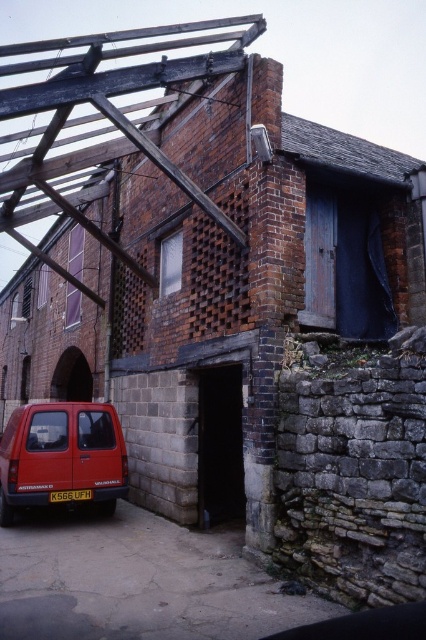
Question: Does black stone door at lower center appear under yellow plastic license plate at lower center?

Choices:
 (A) yes
 (B) no

Answer: (B)

Question: Considering the real-world distances, which object is farthest from the matte red van at lower left?

Choices:
 (A) black stone door at lower center
 (B) yellow plastic license plate at lower center

Answer: (A)

Question: Is matte red van at lower left above yellow plastic license plate at lower center?

Choices:
 (A) no
 (B) yes

Answer: (B)

Question: Does matte red van at lower left have a smaller size compared to yellow plastic license plate at lower center?

Choices:
 (A) no
 (B) yes

Answer: (A)

Question: Which of these objects is positioned closest to the black stone door at lower center?

Choices:
 (A) matte red van at lower left
 (B) yellow plastic license plate at lower center

Answer: (A)

Question: Which point appears farthest from the camera in this image?

Choices:
 (A) (83, 497)
 (B) (204, 490)

Answer: (B)